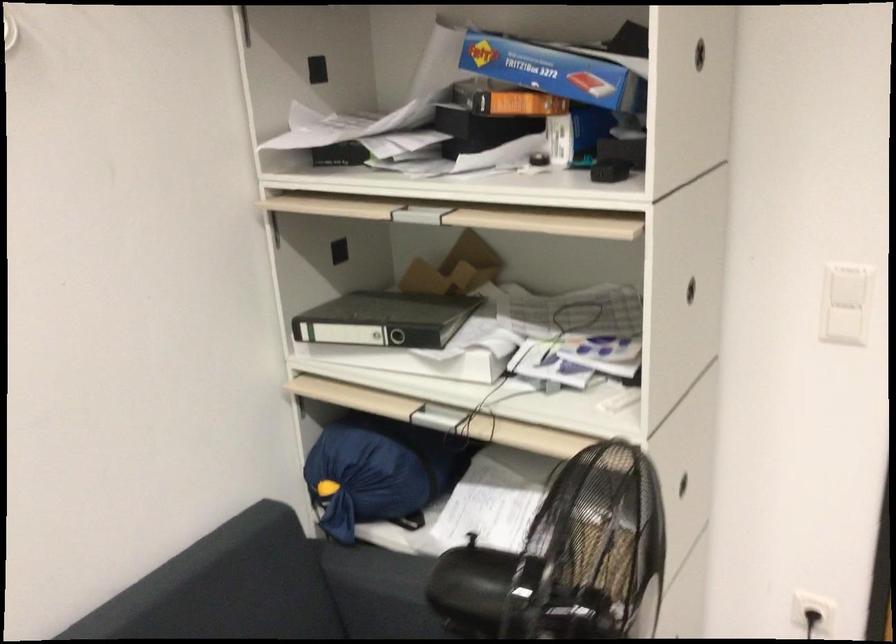
What are the coordinates of `round cabinet handle` in the screenshot? It's located at [608, 171].